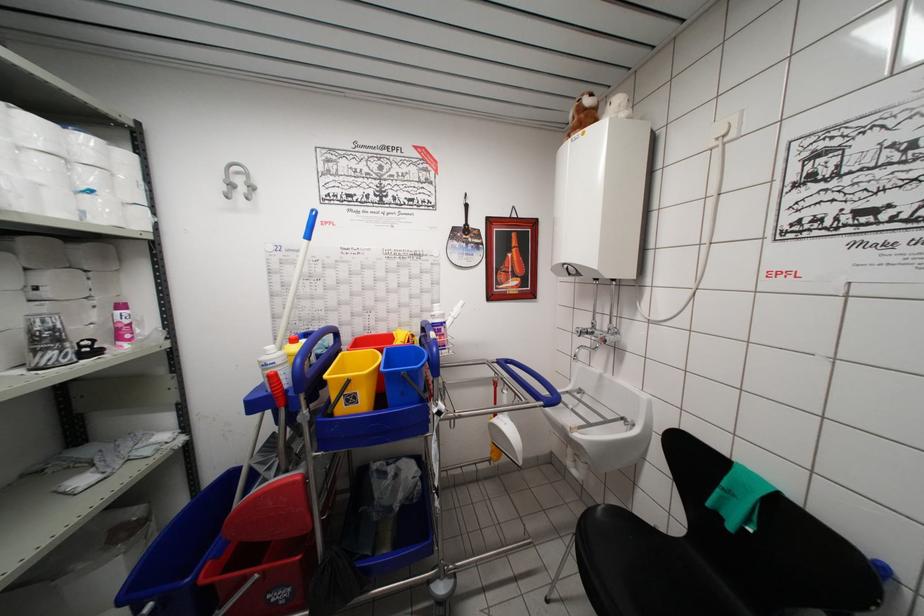
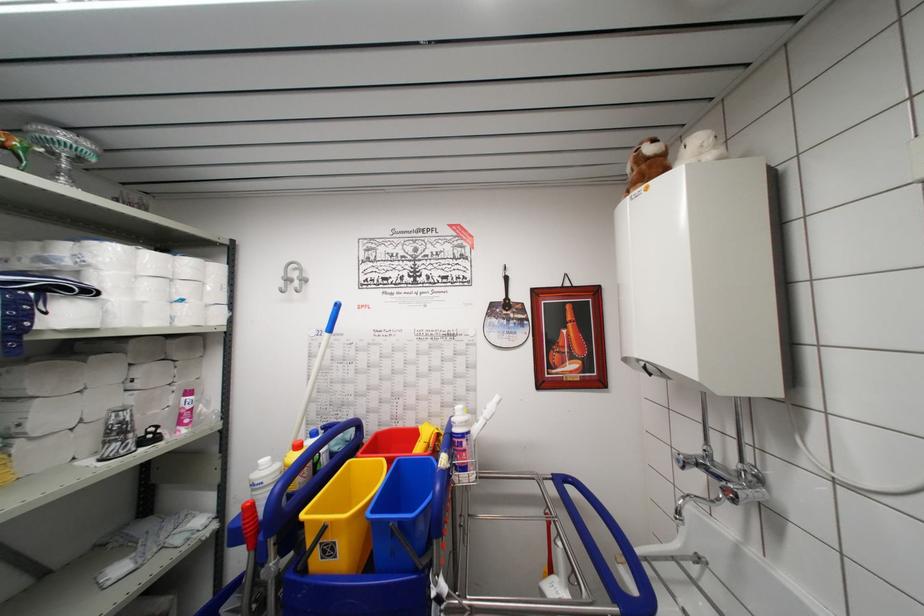
Where in the second image is the point corresponding to (391,354) from the first image?

(402, 466)